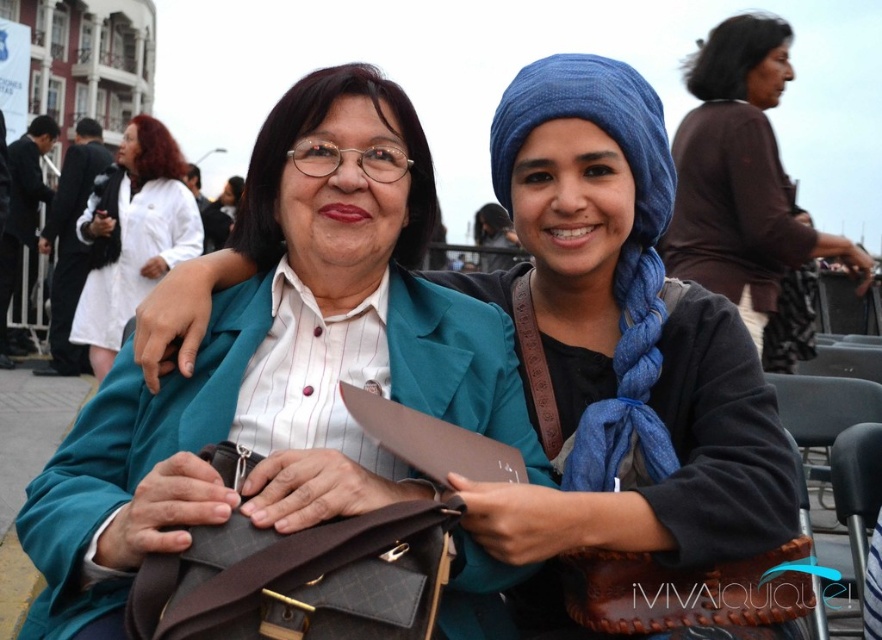
Question: Among these objects, which one is farthest from the camera?

Choices:
 (A) brown matte shirt at upper right
 (B) brown leather bag at center
 (C) blue fabric headscarf at center
 (D) matte teal blazer at center

Answer: (A)

Question: Does matte teal blazer at center lie behind blue fabric headscarf at center?

Choices:
 (A) no
 (B) yes

Answer: (A)

Question: Can you confirm if brown matte shirt at upper right is positioned to the left of white smooth coat at upper left?

Choices:
 (A) no
 (B) yes

Answer: (A)

Question: Can you confirm if matte teal blazer at center is thinner than blue fabric headscarf at center?

Choices:
 (A) yes
 (B) no

Answer: (B)

Question: Which of the following is the closest to the observer?

Choices:
 (A) matte teal blazer at center
 (B) brown matte shirt at upper right

Answer: (A)

Question: Estimate the real-world distances between objects in this image. Which object is closer to the blue fabric headscarf at center?

Choices:
 (A) matte teal blazer at center
 (B) brown matte shirt at upper right
 (C) white smooth coat at upper left
 (D) brown leather bag at center

Answer: (A)